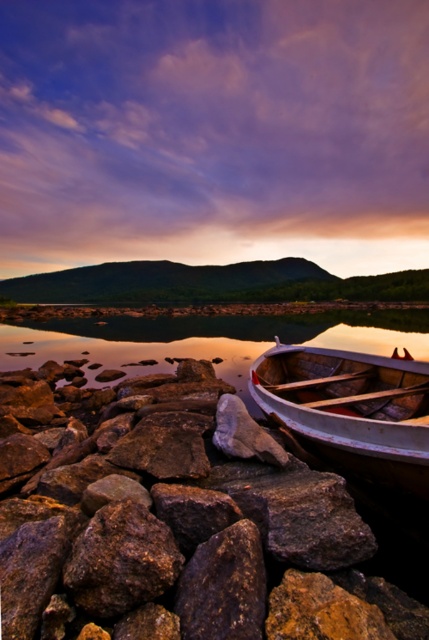
Question: Which of the following is the closest to the observer?

Choices:
 (A) glossy water at boat right
 (B) brown rough rock at center

Answer: (B)

Question: Observing the image, what is the correct spatial positioning of brown rough rock at center in reference to glossy water at boat right?

Choices:
 (A) above
 (B) below

Answer: (B)

Question: Is brown rough rock at center below wooden boat at lower right?

Choices:
 (A) no
 (B) yes

Answer: (B)

Question: Which point is closer to the camera?

Choices:
 (A) (41, 337)
 (B) (81, 577)
 (C) (263, 394)

Answer: (B)

Question: Which of the following is the closest to the observer?

Choices:
 (A) wooden boat at lower right
 (B) glossy water at boat right

Answer: (A)

Question: Is brown rough rock at center below glossy water at boat right?

Choices:
 (A) no
 (B) yes

Answer: (B)